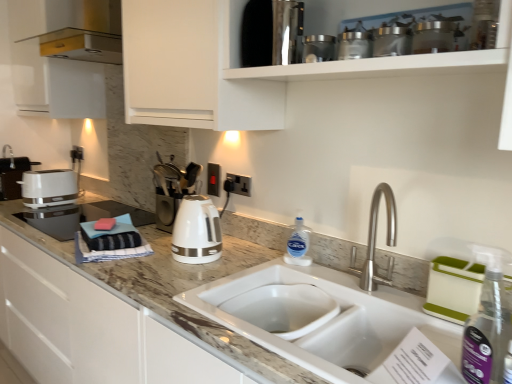
Find the location of a particular element. vacant space that is to the left of white glossy electric kettle at center is located at coordinates (149, 261).